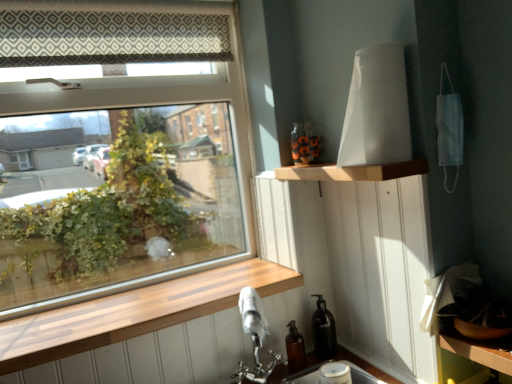
What do you see at coordinates (112, 191) in the screenshot?
I see `transparent glass window at upper left` at bounding box center [112, 191].

I want to click on wooden shelf at upper center, so click(x=353, y=171).

Find the location of `window behind the wooden shelf at upper center`. window behind the wooden shelf at upper center is located at coordinates (112, 191).

From the image's perspective, which is above, wooden shelf at upper center or transparent glass window at upper left?

transparent glass window at upper left is shown above in the image.

Which object is more forward, wooden shelf at upper center or transparent glass window at upper left?

Positioned in front is wooden shelf at upper center.

From a real-world perspective, is wooden shelf at upper center above or below transparent glass window at upper left?

From a real-world perspective, wooden shelf at upper center is physically below transparent glass window at upper left.

From the image's perspective, would you say wooden shelf at upper center is shown under wooden at lower left?

No, from the image's perspective, wooden shelf at upper center is not below wooden at lower left.

Which is more to the right, wooden shelf at upper center or wooden at lower left?

From the viewer's perspective, wooden shelf at upper center appears more on the right side.

Is wooden shelf at upper center in front of or behind wooden at lower left in the image?

Visually, wooden shelf at upper center is located in front of wooden at lower left.

Would you say wooden at lower left is part of wooden shelf at upper center's contents?

No, wooden at lower left is not inside wooden shelf at upper center.

Is wooden at lower left beside wooden shelf at upper center?

No, wooden at lower left is not in contact with wooden shelf at upper center.

From the picture: From the image's perspective, is wooden at lower left located above or below wooden shelf at upper center?

Based on their image positions, wooden at lower left is located beneath wooden shelf at upper center.

I want to click on window sill behind the wooden shelf at upper center, so click(133, 312).

From a real-world perspective, is transparent glass window at upper left physically above wooden shelf at upper center?

Indeed, from a real-world perspective, transparent glass window at upper left stands above wooden shelf at upper center.

Would you say transparent glass window at upper left is a long distance from wooden shelf at upper center?

Yes, transparent glass window at upper left and wooden shelf at upper center are located far from each other.

Which object is further away from the camera, transparent glass window at upper left or wooden shelf at upper center?

transparent glass window at upper left is more distant.

Does point (210, 231) come closer to viewer compared to point (423, 173)?

No, (210, 231) is further to viewer.

Is wooden at lower left positioned beyond the bounds of transparent glass window at upper left?

Indeed, wooden at lower left is completely outside transparent glass window at upper left.

Considering the positions of objects wooden at lower left and transparent glass window at upper left in the image provided, who is more to the right, wooden at lower left or transparent glass window at upper left?

From the viewer's perspective, wooden at lower left appears more on the right side.

Is the position of wooden at lower left more distant than that of transparent glass window at upper left?

No, the depth of wooden at lower left is less than that of transparent glass window at upper left.

What's the angular difference between wooden at lower left and transparent glass window at upper left's facing directions?

0.182 degrees.

Considering the relative sizes of transparent glass window at upper left and wooden at lower left in the image provided, is transparent glass window at upper left shorter than wooden at lower left?

No.

Can you tell me how much transparent glass window at upper left and wooden at lower left differ in facing direction?

The angular difference between transparent glass window at upper left and wooden at lower left is 0.182 degrees.

Considering the sizes of transparent glass window at upper left and wooden at lower left in the image, is transparent glass window at upper left wider or thinner than wooden at lower left?

Considering their sizes, transparent glass window at upper left looks slimmer than wooden at lower left.

Measure the distance between transparent glass window at upper left and wooden at lower left.

transparent glass window at upper left and wooden at lower left are 7.75 feet apart from each other.

Image resolution: width=512 pixels, height=384 pixels. Find the location of `shelf below the transparent glass window at upper left (from a real-world perspective)`. shelf below the transparent glass window at upper left (from a real-world perspective) is located at coordinates (353, 171).

At what (x,y) coordinates should I click in order to perform the action: click on window sill behind the wooden shelf at upper center. Please return your answer as a coordinate pair (x, y). The height and width of the screenshot is (384, 512). Looking at the image, I should click on click(x=133, y=312).

Which object lies nearer to the anchor point wooden at lower left, wooden shelf at upper center or transparent glass window at upper left?

wooden shelf at upper center lies closer to wooden at lower left than the other object.

Considering their positions, is wooden shelf at upper center positioned closer to transparent glass window at upper left than wooden at lower left?

The object closer to transparent glass window at upper left is wooden at lower left.

When comparing their distances from wooden at lower left, does transparent glass window at upper left or wooden shelf at upper center seem further?

Based on the image, transparent glass window at upper left appears to be further to wooden at lower left.

Looking at the image, which one is located further to wooden shelf at upper center, transparent glass window at upper left or wooden at lower left?

transparent glass window at upper left is further to wooden shelf at upper center.

From the image, which object appears to be farther from wooden shelf at upper center, wooden at lower left or transparent glass window at upper left?

The object further to wooden shelf at upper center is transparent glass window at upper left.

Looking at the image, which one is located closer to transparent glass window at upper left, wooden at lower left or wooden shelf at upper center?

wooden at lower left.

Where is `window sill between transparent glass window at upper left and wooden shelf at upper center from left to right`? window sill between transparent glass window at upper left and wooden shelf at upper center from left to right is located at coordinates (133, 312).